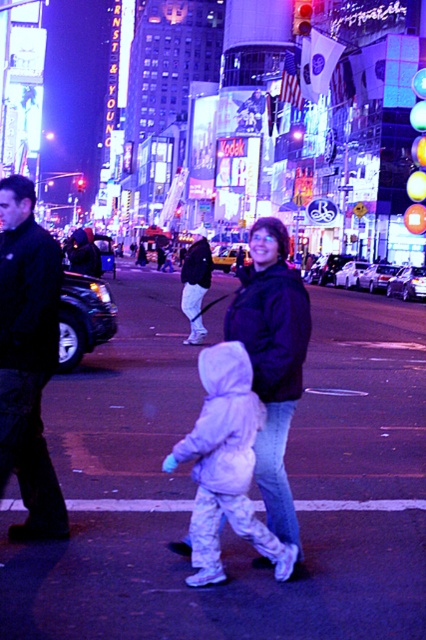
Can you confirm if dark blue jacket at left is positioned below white fleece jacket at center?

Incorrect, dark blue jacket at left is not positioned below white fleece jacket at center.

Is dark blue jacket at left positioned at the back of white fleece jacket at center?

Yes, dark blue jacket at left is behind white fleece jacket at center.

Which is in front, point (2, 422) or point (249, 378)?

Point (249, 378)

At what (x,y) coordinates should I click in order to perform the action: click on dark blue jacket at left. Please return your answer as a coordinate pair (x, y). Image resolution: width=426 pixels, height=640 pixels. Looking at the image, I should click on (28, 358).

Who is shorter, dark blue jacket at left or dark blue jacket at center?

With less height is dark blue jacket at center.

Can you confirm if dark blue jacket at left is bigger than dark blue jacket at center?

No, dark blue jacket at left is not bigger than dark blue jacket at center.

At what (x,y) coordinates should I click in order to perform the action: click on dark blue jacket at left. Please return your answer as a coordinate pair (x, y). Image resolution: width=426 pixels, height=640 pixels. Looking at the image, I should click on (28, 358).

Does dark blue jacket at center have a greater width compared to white fleece jacket at center?

No, dark blue jacket at center is not wider than white fleece jacket at center.

Is dark blue jacket at center smaller than white fleece jacket at center?

No, dark blue jacket at center is not smaller than white fleece jacket at center.

Does point (308, 301) come behind point (239, 486)?

Yes.

In order to click on dark blue jacket at center in this screenshot , I will do `click(273, 358)`.